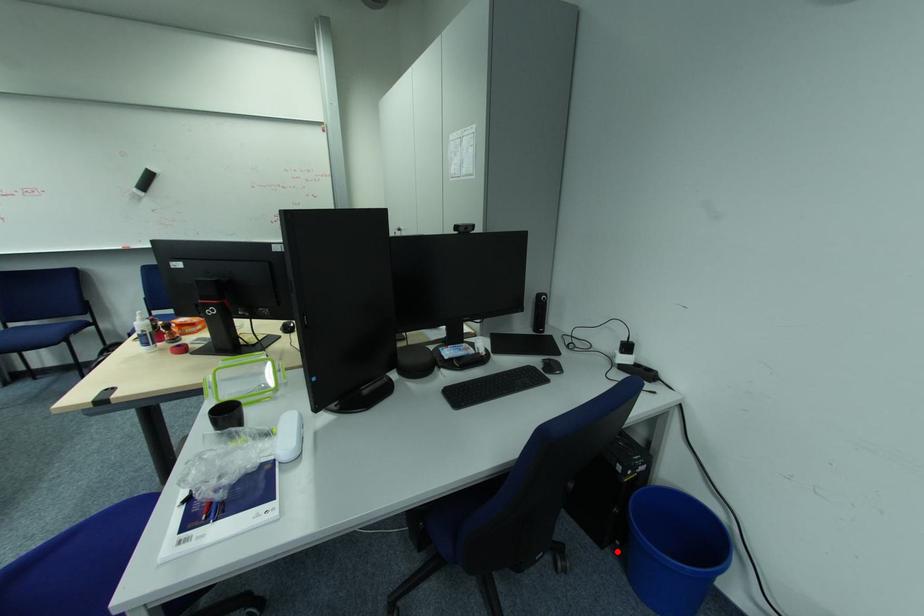
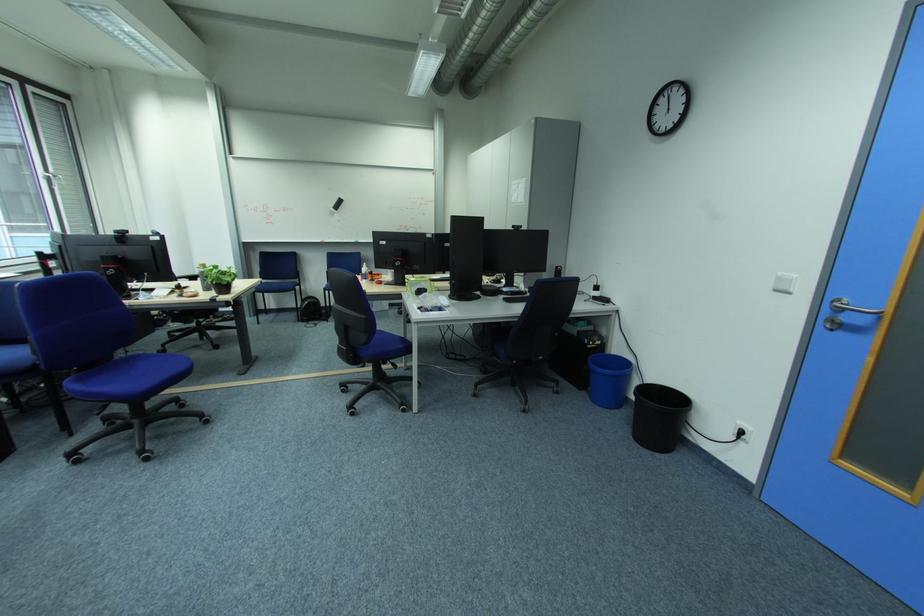
In the second image, find the point that corresponds to the highlighted location in the first image.

(592, 392)